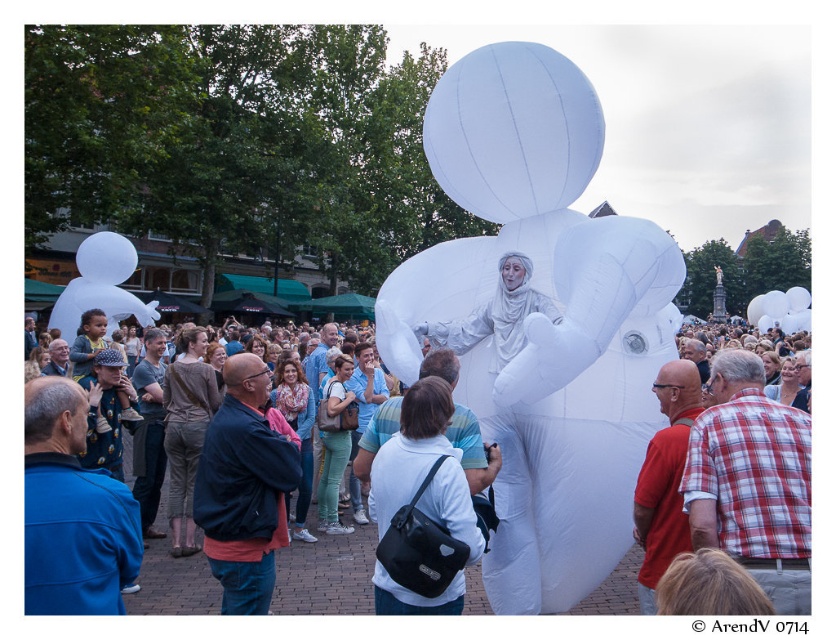
You are standing at the center of the scene and want to pick up an item located at point (424, 467). What item is there?

The white matte bag at center is located at point (424, 467).

You are a photographer standing at the edge of the crowd, wanting to take a photo that includes both the white inflatable figure at center and the white matte bag at center. Given that your camera has a maximum focus range of 10 meters, can you capture both objects in the same frame without moving your position?

The white inflatable figure at center and white matte bag at center are 9.36 meters apart from each other. Since the distance between them is within the camera maximum focus range of 10 meters, you can capture both objects in the same frame without moving your position.